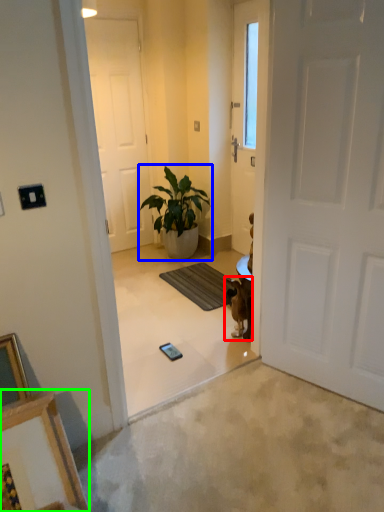
Question: Considering the real-world distances, which object is closest to animal (highlighted by a red box)? houseplant (highlighted by a blue box) or picture frame (highlighted by a green box).

Choices:
 (A) houseplant
 (B) picture frame

Answer: (A)